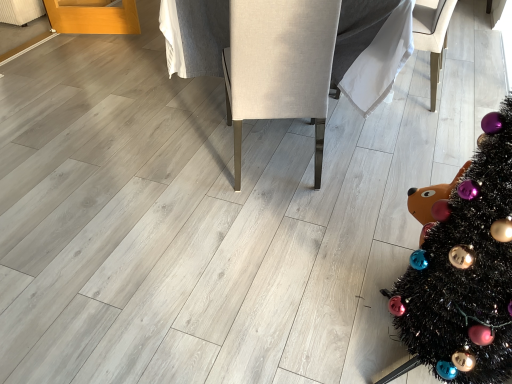
At what (x,y) coordinates should I click in order to perform the action: click on vacant area to the left of black tinsel christmas tree at lower right. Please return your answer as a coordinate pair (x, y). Looking at the image, I should click on point(309,318).